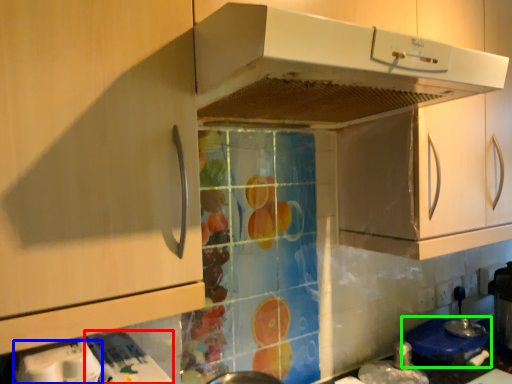
Question: Which is nearer to the appliance (highlighted by a red box)? appliance (highlighted by a blue box) or appliance (highlighted by a green box).

Choices:
 (A) appliance
 (B) appliance

Answer: (A)